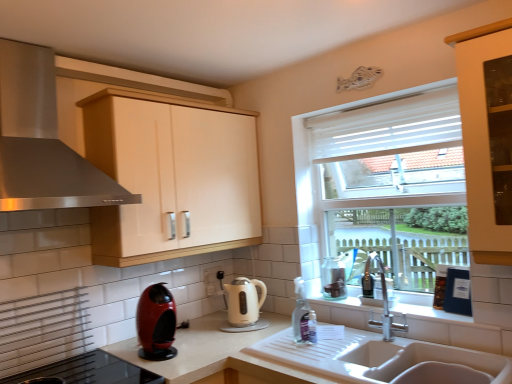
Locate an element on the screen. The width and height of the screenshot is (512, 384). vacant space in shiny red coffee machine at lower left, positioned as the 1th kitchen appliance in left-to-right order (from a real-world perspective) is located at coordinates (157, 350).